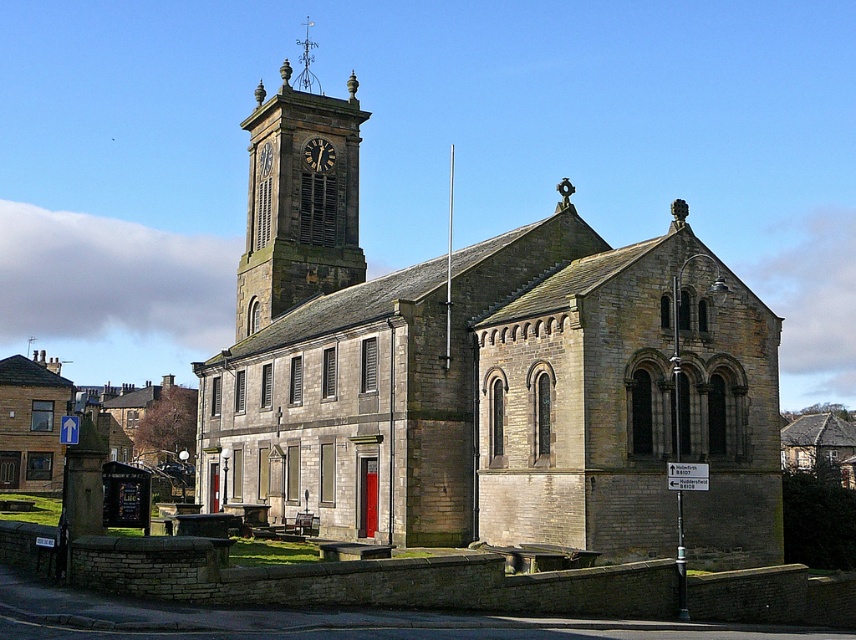
Question: Is stone clock tower at upper left above polished metal spire at upper center?

Choices:
 (A) no
 (B) yes

Answer: (A)

Question: Estimate the real-world distances between objects in this image. Which object is closer to the dark brown wooden clock at upper center?

Choices:
 (A) matte stone clock at upper center
 (B) stone clock tower at upper left
 (C) stone church at center

Answer: (A)

Question: From the image, what is the correct spatial relationship of polished metal spire at upper center in relation to dark brown wooden clock at upper center?

Choices:
 (A) left
 (B) right

Answer: (A)

Question: Which object is closer to the camera taking this photo?

Choices:
 (A) stone church at center
 (B) stone clock tower at upper left
 (C) dark brown wooden clock at upper center
 (D) matte stone clock at upper center

Answer: (A)

Question: Which point appears closest to the camera in this image?

Choices:
 (A) (366, 115)
 (B) (282, 113)
 (C) (325, 147)

Answer: (B)

Question: Is the position of stone clock tower at upper left more distant than that of matte stone clock at upper center?

Choices:
 (A) no
 (B) yes

Answer: (A)